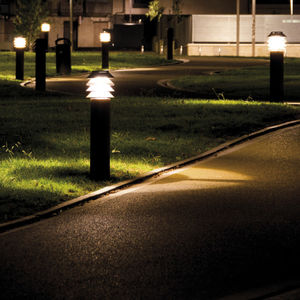
Image resolution: width=300 pixels, height=300 pixels. Find the location of `door`. door is located at coordinates (96, 30).